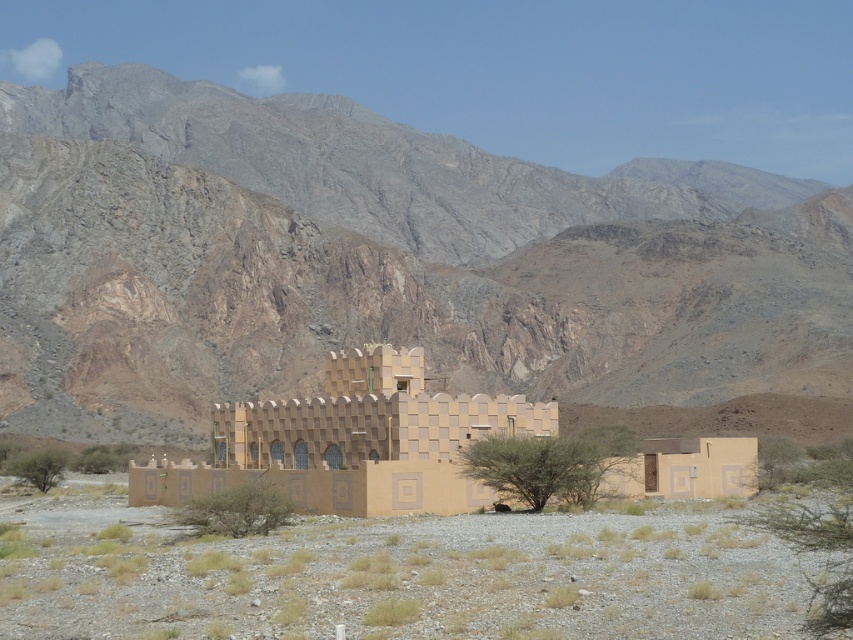
Question: Which of the following is the farthest from the observer?

Choices:
 (A) (421, 349)
 (B) (543, 544)
 (C) (451, 333)

Answer: (C)

Question: Which point is farther from the camera taking this photo?

Choices:
 (A) (279, 131)
 (B) (144, 563)

Answer: (A)

Question: Does beige sand at center appear over beige textured fort at center?

Choices:
 (A) no
 (B) yes

Answer: (A)

Question: Is brown rocky mountain range at upper center below beige sand at center?

Choices:
 (A) no
 (B) yes

Answer: (A)

Question: Can you confirm if brown rocky mountain range at upper center is bigger than beige textured fort at center?

Choices:
 (A) yes
 (B) no

Answer: (A)

Question: Which point is closer to the camera?

Choices:
 (A) beige sand at center
 (B) brown rocky mountain range at upper center
 (C) beige textured fort at center

Answer: (A)